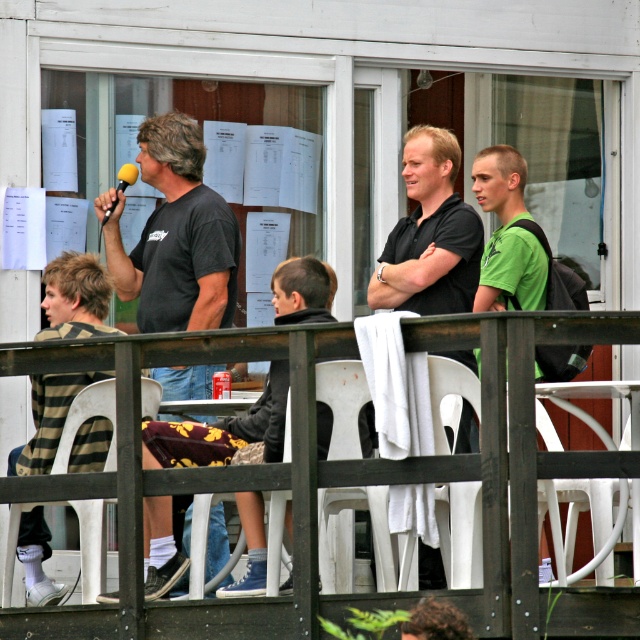
Question: Is dark gray sweater at center behind white plastic chair at center?

Choices:
 (A) yes
 (B) no

Answer: (A)

Question: Which object appears closest to the camera in this image?

Choices:
 (A) dark gray sweater at center
 (B) white plastic chair at center
 (C) black matte shirt at center
 (D) green matte shirt at right

Answer: (B)

Question: Does dark gray sweater at center appear on the left side of white plastic chair at lower left?

Choices:
 (A) no
 (B) yes

Answer: (A)

Question: Can you confirm if dark gray sweater at center is thinner than white plastic chair at lower left?

Choices:
 (A) no
 (B) yes

Answer: (A)

Question: Among these points, which one is nearest to the camera?

Choices:
 (A) (356, 451)
 (B) (64, 500)

Answer: (A)

Question: Which object is closer to the camera taking this photo?

Choices:
 (A) black matte t-shirt at left
 (B) green matte shirt at right

Answer: (A)